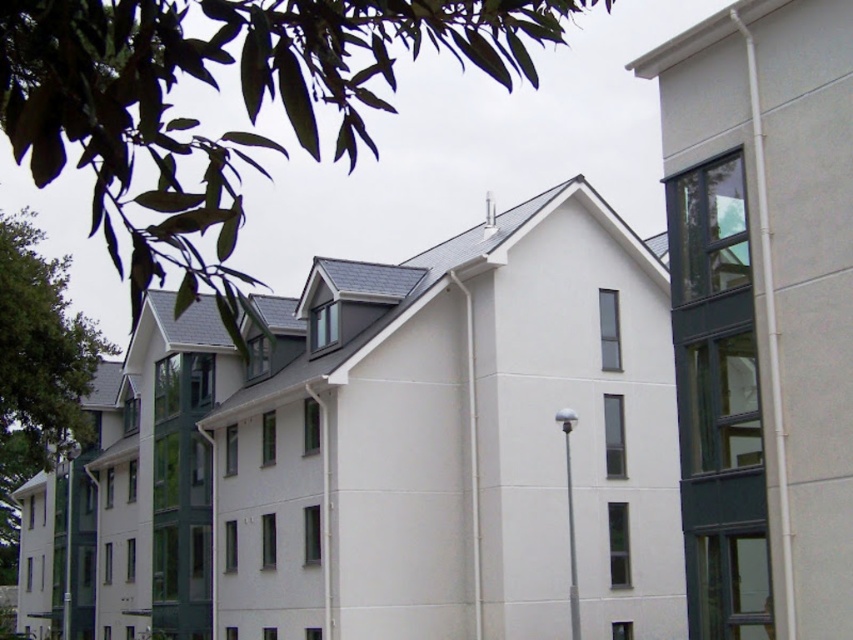
You are standing at the base of the modern residential building and want to locate two points marked on the building. The first point is at coordinates point (444,28) and the second is at point (83,365). Which point appears closer to you?

Point (444,28) is closer to the viewer than point (83,365), so the first point appears closer.

Based on the photo, you are standing in front of a modern residential building. You see a green leafy tree at upper left. Can you reach the tree without moving from your current position?

The green leafy tree at upper left is 4.02 meters away from you, so you can reach it without moving from your current position since it is within arm reach.